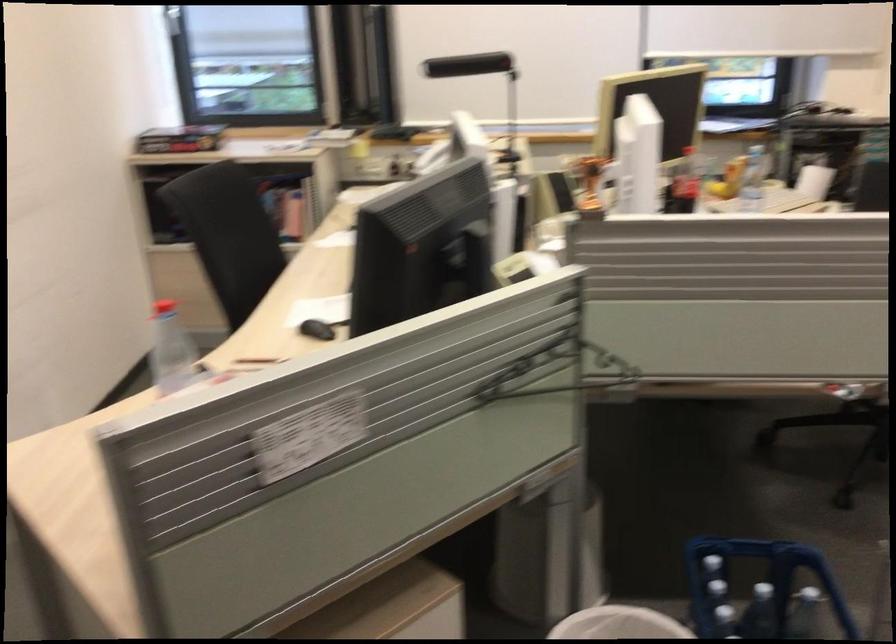
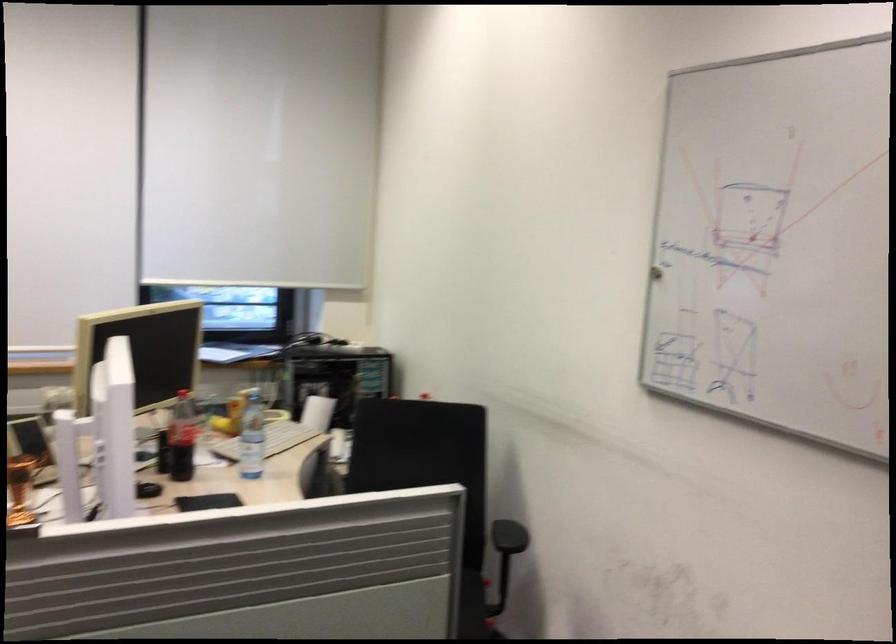
In the second image, find the point that corresponds to the point at 691,187 in the first image.

(182, 438)